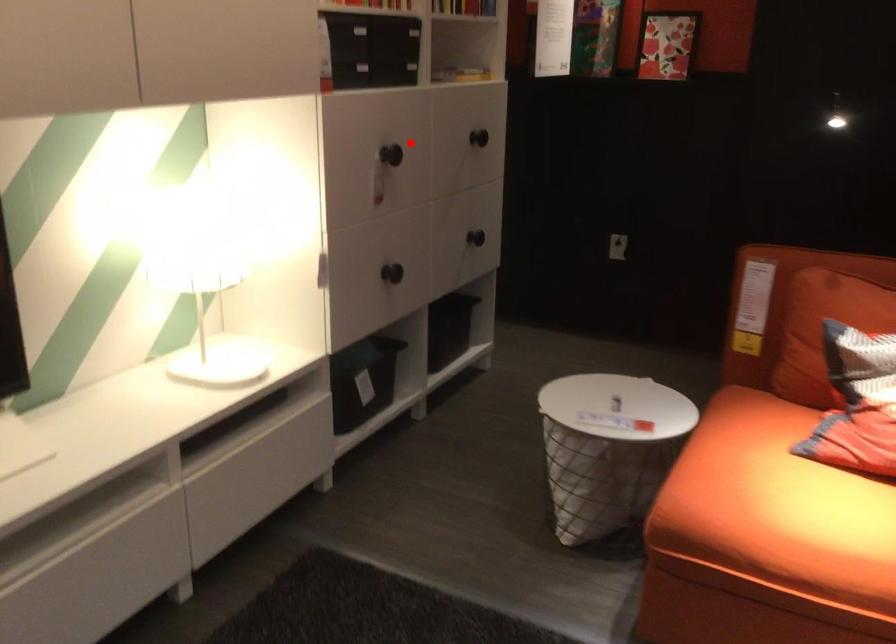
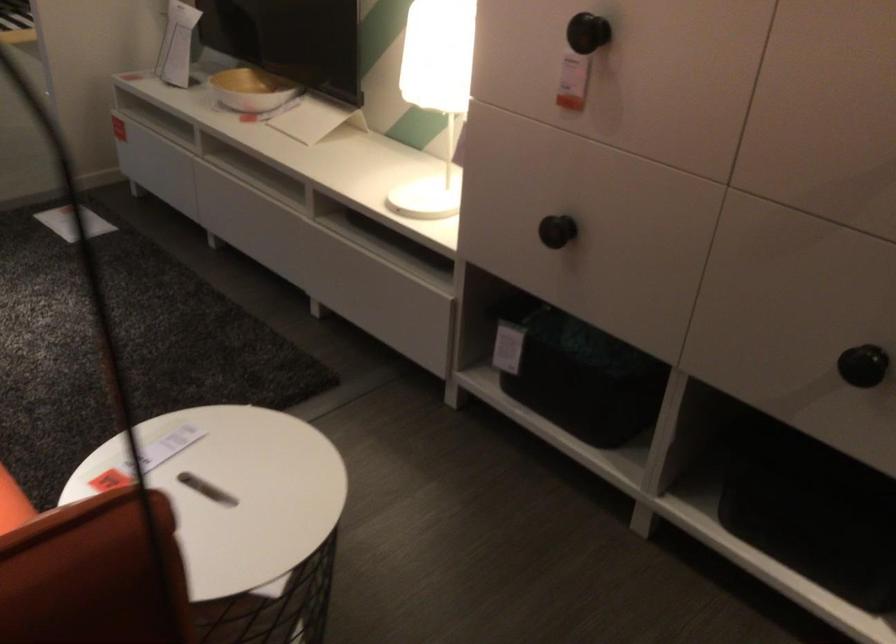
Find the pixel in the second image that matches the highlighted location in the first image.

(588, 33)